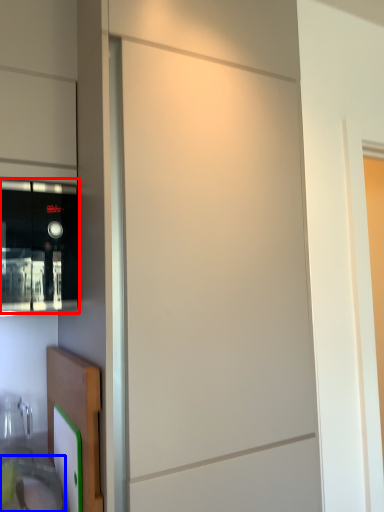
Question: Which object appears closest to the camera in this image, home appliance (highlighted by a red box) or sink (highlighted by a blue box)?

Choices:
 (A) home appliance
 (B) sink

Answer: (B)